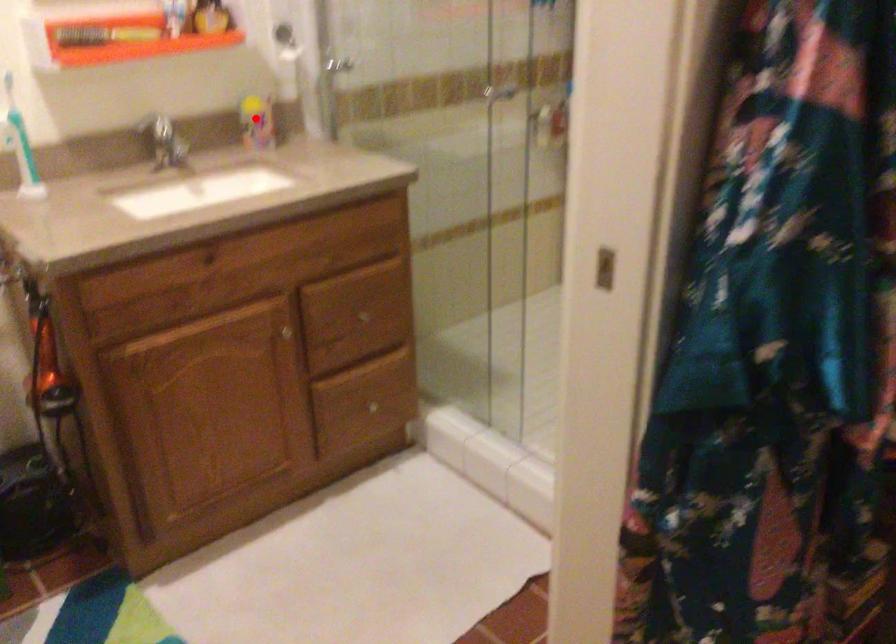
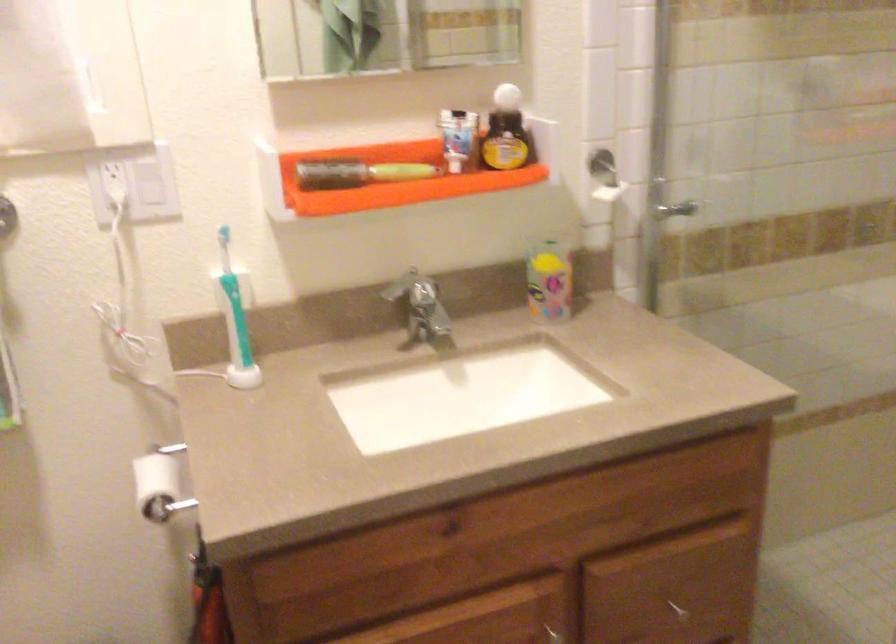
Where in the second image is the point corresponding to the highlighted location from the first image?

(549, 279)